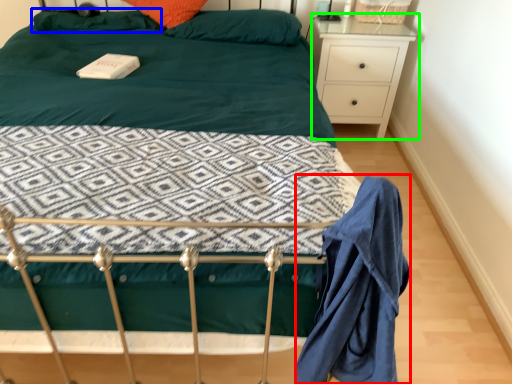
Question: Estimate the real-world distances between objects in this image. Which object is closer to robe (highlighted by a red box), pillow (highlighted by a blue box) or nightstand (highlighted by a green box)?

Choices:
 (A) pillow
 (B) nightstand

Answer: (B)